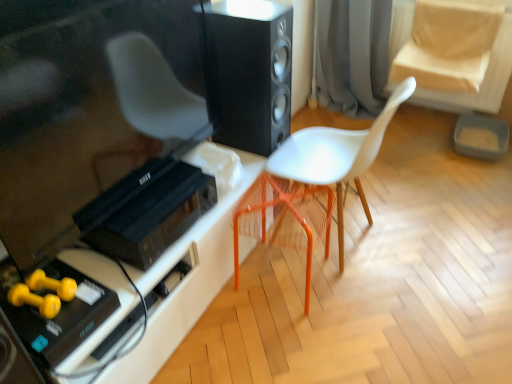
Image resolution: width=512 pixels, height=384 pixels. Find the location of `vacant area that lies between white matte chair at center and orange plastic swivel chair at center`. vacant area that lies between white matte chair at center and orange plastic swivel chair at center is located at coordinates (333, 294).